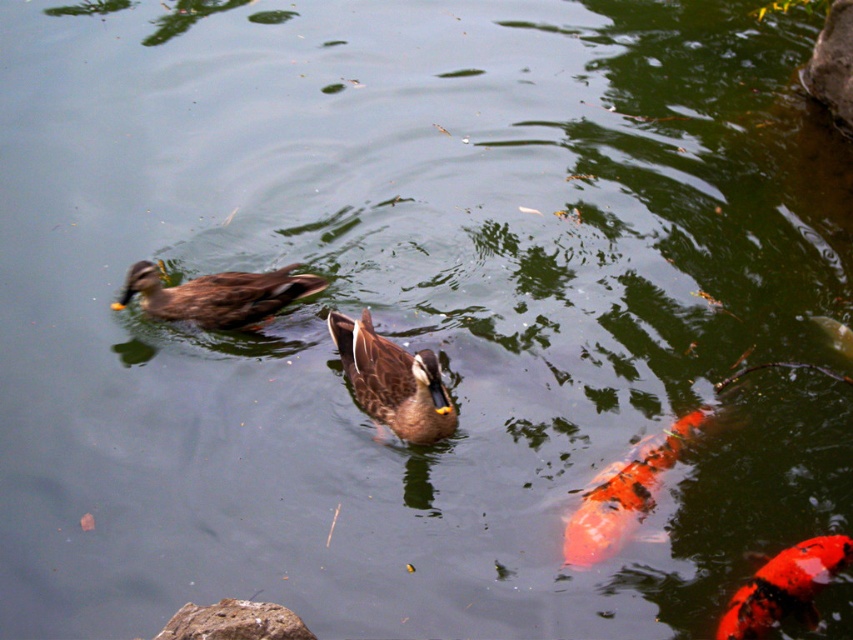
You are standing at the edge of the water and see the brown matte duck at center and the rough textured rock at lower left. Which object is closer to your right side?

The brown matte duck at center is positioned on the right side of rough textured rock at lower left, so from your perspective at the edge, the brown matte duck at center would be to your right.

Looking at this image, you are standing at the edge of the water and see two points in the scene, point (223,317) and point (286,621). Which point is closer to you?

Point (223,317) is further to the viewer than point (286,621), so the closer point to you is point (223,317).

You are a small toy boat that is 10 cm long. You want to sail from the brown matte duck at center to the shiny orange fish at lower right. Can you fit between them without touching either?

The brown matte duck at center might be wider than shiny orange fish at lower right, but since the exact distance isn not provided, it is uncertain if the boat can fit. More information is needed.